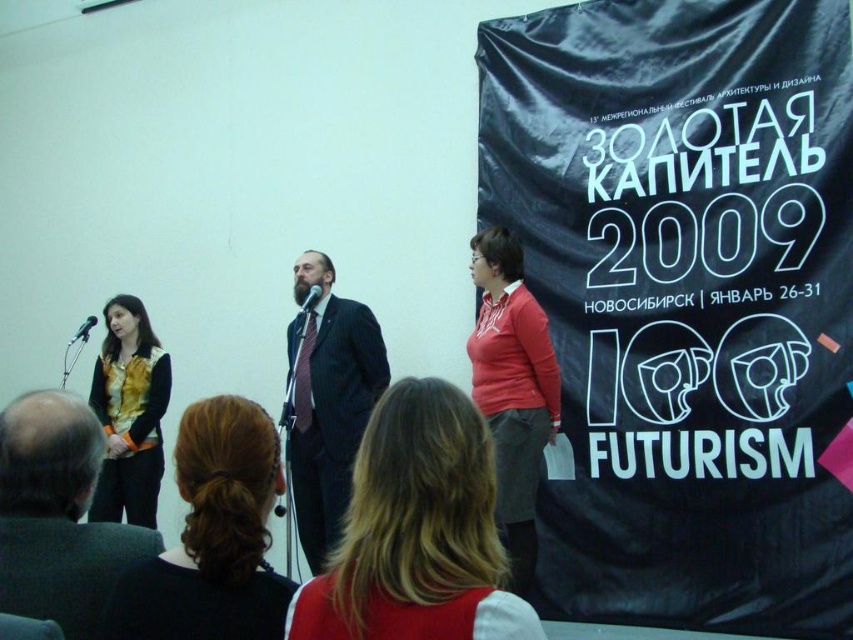
Is point (123, 604) farther from camera compared to point (16, 566)?

No, (123, 604) is in front of (16, 566).

Find the location of a particular element. This screenshot has width=853, height=640. dark brown hair at center is located at coordinates (212, 536).

Measure the distance between black fabric banner at right and dark brown hair at center.

black fabric banner at right and dark brown hair at center are 3.16 meters apart.

Is point (701, 380) less distant than point (129, 572)?

No, (701, 380) is behind (129, 572).

Is point (672, 241) farther from viewer compared to point (233, 436)?

Yes.

Locate an element on the screen. black fabric banner at right is located at coordinates (685, 300).

Is dark pinstripe suit at center shorter than black metallic microphone at center?

No.

Can you confirm if dark pinstripe suit at center is positioned to the left of black metallic microphone at center?

Incorrect, dark pinstripe suit at center is not on the left side of black metallic microphone at center.

Identify the location of dark pinstripe suit at center. tap(328, 401).